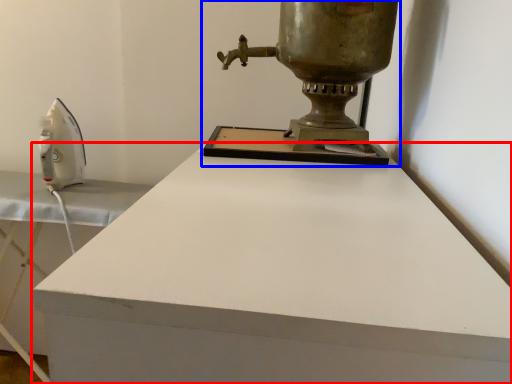
Question: Among these objects, which one is farthest to the camera, desk (highlighted by a red box) or sewing machine (highlighted by a blue box)?

Choices:
 (A) desk
 (B) sewing machine

Answer: (B)